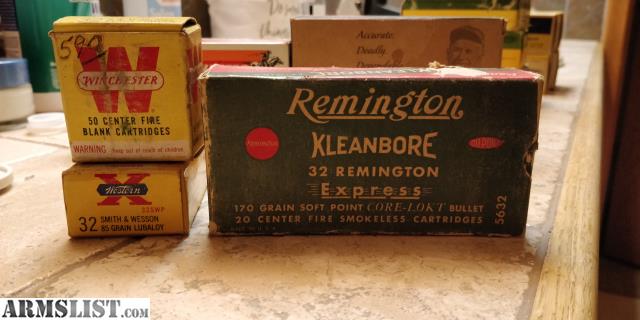
This screenshot has width=640, height=320. I want to click on wooden table, so click(275, 269).